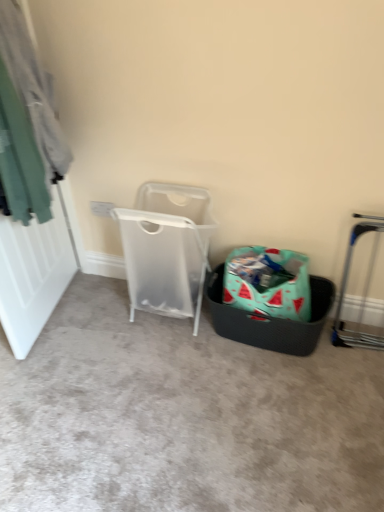
Question: Is teal fabric at left taller or shorter than silver metallic trolley at right?

Choices:
 (A) tall
 (B) short

Answer: (A)

Question: From a real-world perspective, is teal fabric at left positioned above or below silver metallic trolley at right?

Choices:
 (A) above
 (B) below

Answer: (A)

Question: Which object is positioned closest to the teal woven basket at lower right?

Choices:
 (A) silver metallic trolley at right
 (B) teal fabric at left
 (C) transparent plastic laundry basket at center
 (D) black textured basket at center
 (E) watermelon-patterned fabric shopping bag at center

Answer: (E)

Question: Which is farther from the watermelon-patterned fabric shopping bag at center?

Choices:
 (A) silver metallic trolley at right
 (B) teal fabric at left
 (C) transparent plastic laundry basket at center
 (D) teal woven basket at lower right
 (E) black textured basket at center

Answer: (B)